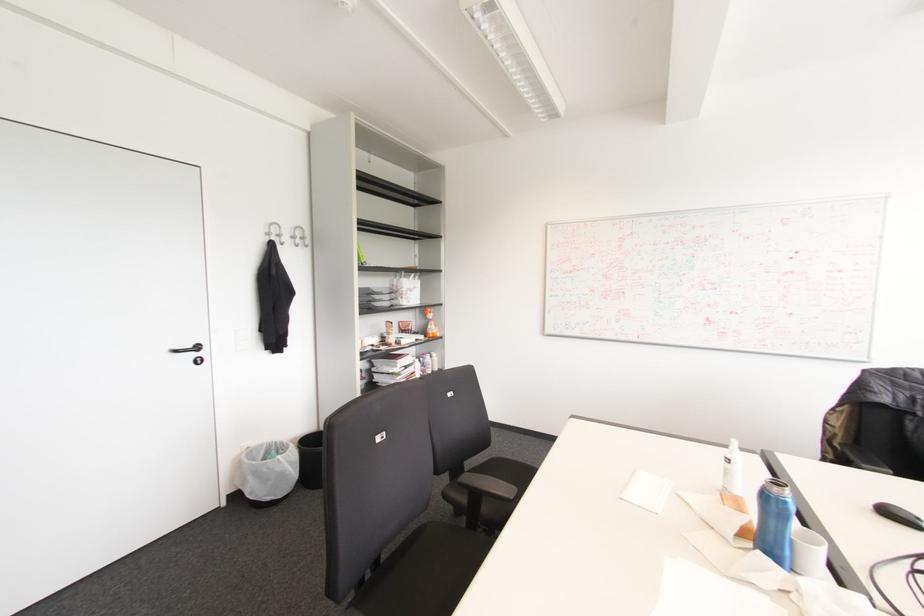
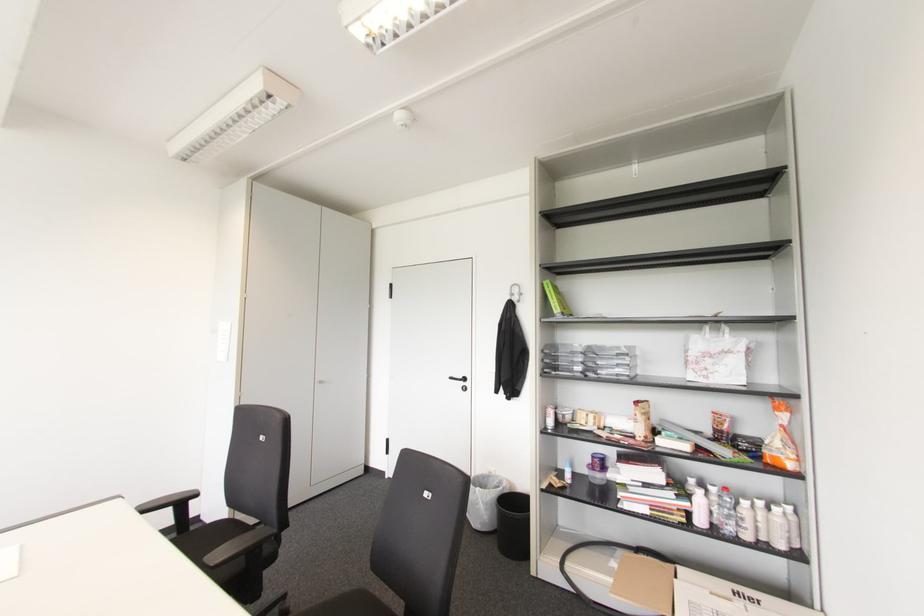
In the second image, find the point that corresponds to point (197, 347) in the first image.

(464, 379)